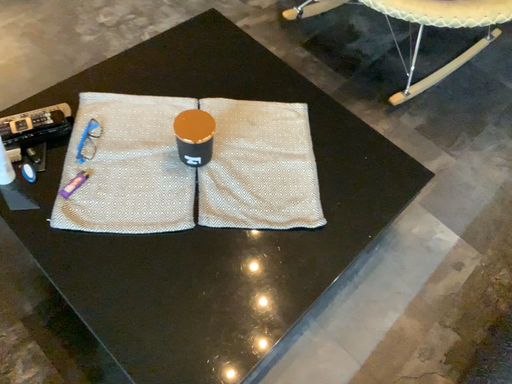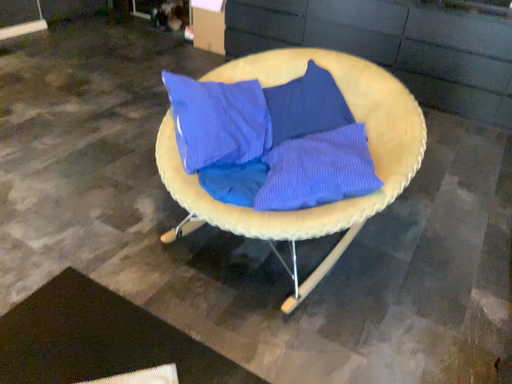
Question: How did the camera likely rotate when shooting the video?

Choices:
 (A) rotated downward
 (B) rotated upward

Answer: (B)